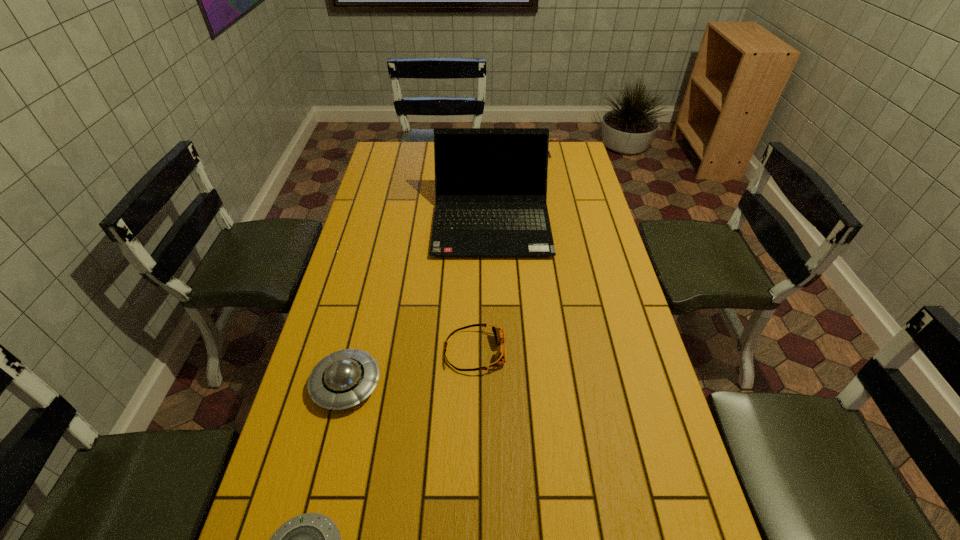
Identify the location of vacant space located 0.290m with the lenses facing forward on the fourth tallest object. (611, 351).

The image size is (960, 540). I want to click on object present at the far edge, so click(550, 139).

Find the location of `object that is at the left edge`. object that is at the left edge is located at coordinates (342, 379).

Identify the location of object that is at the right edge. The height and width of the screenshot is (540, 960). (550, 139).

Locate an element on the screen. The width and height of the screenshot is (960, 540). object that is at the far right corner is located at coordinates (550, 139).

Where is `vacant space at the left edge of the desktop`? This screenshot has width=960, height=540. vacant space at the left edge of the desktop is located at coordinates (365, 271).

You are a GUI agent. You are given a task and a screenshot of the screen. Output one action in this format:
    pyautogui.click(x=<x>, y=<y>)
    Task: Click on the free space at the right edge of the desktop
    The width and height of the screenshot is (960, 540).
    Given the screenshot: What is the action you would take?
    pyautogui.click(x=575, y=172)

The image size is (960, 540). In order to click on free spot at the far right corner of the desktop in this screenshot , I will do `click(568, 170)`.

Where is `vacant region between the taller saucer and the farthest object`? The width and height of the screenshot is (960, 540). vacant region between the taller saucer and the farthest object is located at coordinates (444, 271).

Where is `empty space that is in between the third shortest object and the fourth tallest object`? This screenshot has height=540, width=960. empty space that is in between the third shortest object and the fourth tallest object is located at coordinates (411, 368).